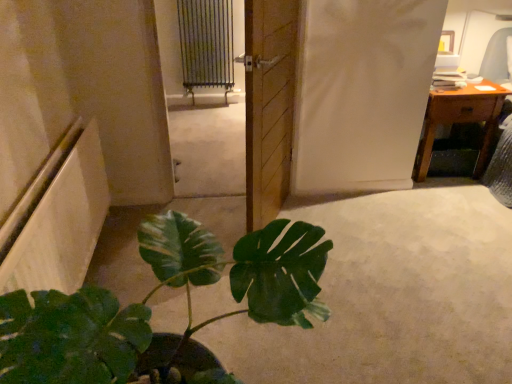
Question: Is wooden door at center in front of wooden desk at upper right?

Choices:
 (A) yes
 (B) no

Answer: (A)

Question: Is wooden desk at upper right at the back of wooden door at center?

Choices:
 (A) yes
 (B) no

Answer: (B)

Question: From the image's perspective, is wooden door at center located above wooden desk at upper right?

Choices:
 (A) no
 (B) yes

Answer: (A)

Question: Is wooden door at center taller than wooden desk at upper right?

Choices:
 (A) yes
 (B) no

Answer: (A)

Question: Can you confirm if wooden door at center is smaller than wooden desk at upper right?

Choices:
 (A) no
 (B) yes

Answer: (B)

Question: Is wooden door at center behind wooden desk at upper right?

Choices:
 (A) no
 (B) yes

Answer: (A)

Question: Is green matte plant at lower left further to camera compared to metallic radiator at upper center?

Choices:
 (A) no
 (B) yes

Answer: (A)

Question: Is green matte plant at lower left taller than metallic radiator at upper center?

Choices:
 (A) no
 (B) yes

Answer: (A)

Question: Is green matte plant at lower left facing towards metallic radiator at upper center?

Choices:
 (A) yes
 (B) no

Answer: (B)

Question: Is green matte plant at lower left thinner than metallic radiator at upper center?

Choices:
 (A) no
 (B) yes

Answer: (A)

Question: Does green matte plant at lower left appear on the right side of metallic radiator at upper center?

Choices:
 (A) no
 (B) yes

Answer: (B)

Question: Can you confirm if green matte plant at lower left is wider than metallic radiator at upper center?

Choices:
 (A) yes
 (B) no

Answer: (A)

Question: Is green matte plant at lower left at the right side of wooden desk at upper right?

Choices:
 (A) yes
 (B) no

Answer: (B)